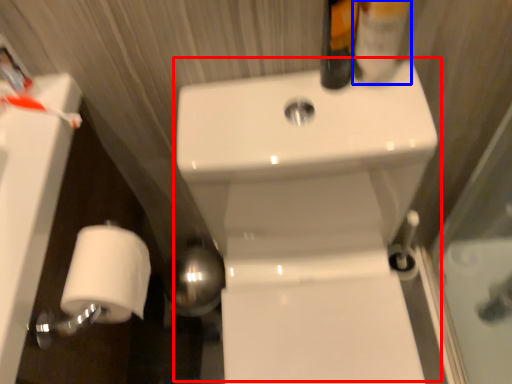
Question: Which object is closer to the camera taking this photo, sink (highlighted by a red box) or mouthwash (highlighted by a blue box)?

Choices:
 (A) sink
 (B) mouthwash

Answer: (A)